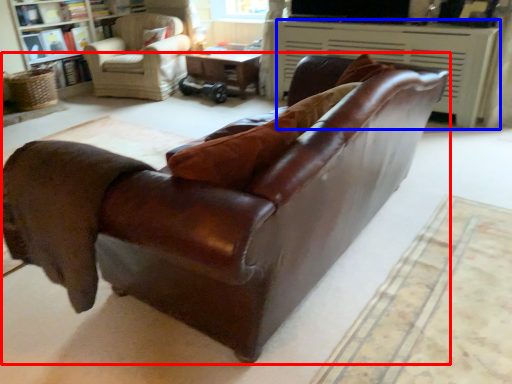
Question: Which object appears closest to the camera in this image, studio couch (highlighted by a red box) or fireplace (highlighted by a blue box)?

Choices:
 (A) studio couch
 (B) fireplace

Answer: (A)